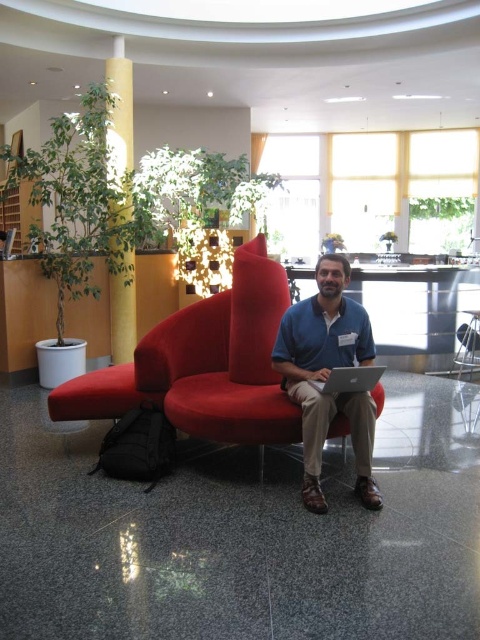
You are a designer planning to place a new artwork in the lobby. The artwork requires a wall space at coordinates between 0.1 and 0.3 on the x and y axes. Is the yellow textured pillar at upper center within this area?

The yellow textured pillar at upper center is located at coordinates point (120,108), which falls within the specified area between 0.1 and 0.3 on both the x and y axes. Therefore, the pillar is within the desired wall space.

You are standing in the lobby and want to place a small potted plant between the yellow textured pillar at upper center and the silver metallic laptop at center. Which object should the plant be closer to if it needs to be near the front of the room?

The plant should be closer to the yellow textured pillar at upper center because it is closer to the viewer than the silver metallic laptop at center, so placing it near the pillar would position it nearer the front of the room.